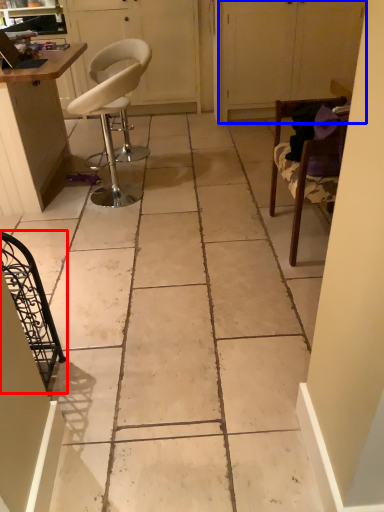
Question: Which object is closer to the camera taking this photo, chair (highlighted by a red box) or screen door (highlighted by a blue box)?

Choices:
 (A) chair
 (B) screen door

Answer: (A)